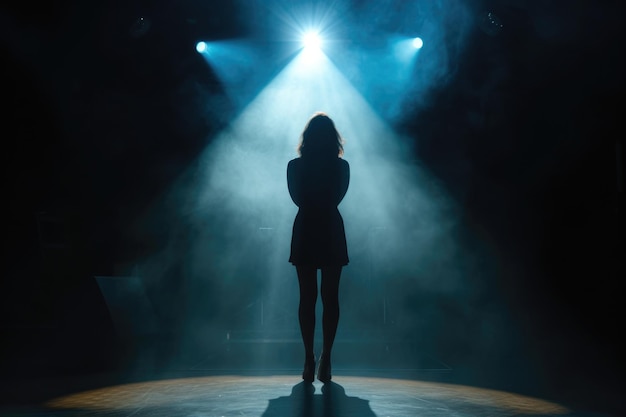
The width and height of the screenshot is (626, 417). What are the coordinates of `light` in the screenshot? It's located at (307, 38).